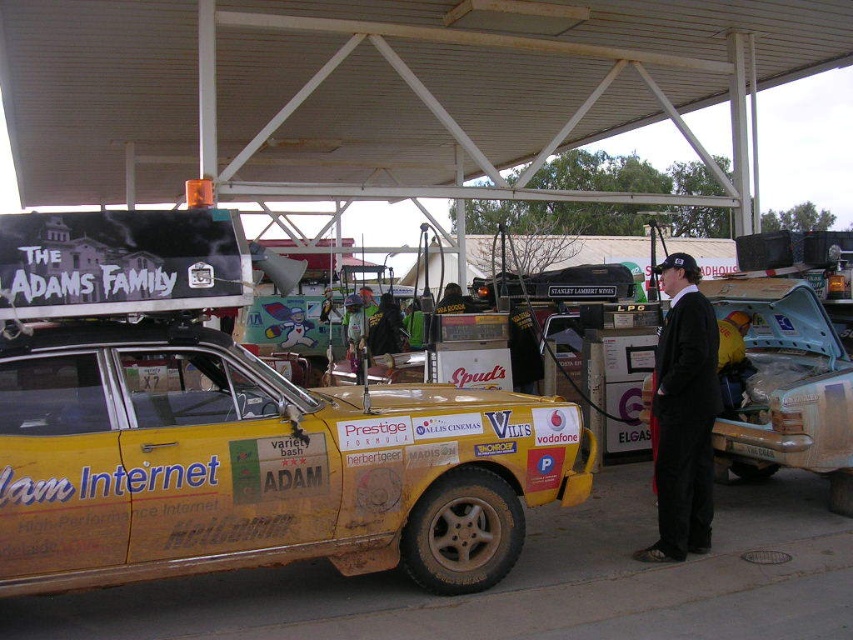
Is rusty metal car at center closer to camera compared to black suit at center?

No.

Is rusty metal car at center thinner than black suit at center?

No, rusty metal car at center is not thinner than black suit at center.

Is point (769, 285) behind point (686, 307)?

Yes, point (769, 285) is behind point (686, 307).

Image resolution: width=853 pixels, height=640 pixels. I want to click on rusty metal car at center, so click(785, 387).

Which is more to the right, yellow matte taxi at center or rusty metal car at center?

From the viewer's perspective, rusty metal car at center appears more on the right side.

Between point (152, 348) and point (817, 324), which one is positioned in front?

Point (152, 348) is more forward.

Is point (239, 513) positioned before point (780, 404)?

Yes, it is in front of point (780, 404).

Identify the location of yellow matte taxi at center. The width and height of the screenshot is (853, 640). (257, 465).

Does point (138, 529) come closer to viewer compared to point (688, 358)?

Yes, it is.

Does point (343, 547) lie behind point (689, 396)?

No, (343, 547) is in front of (689, 396).

Between point (485, 408) and point (677, 534), which one is positioned behind?

Point (677, 534)

You are a GUI agent. You are given a task and a screenshot of the screen. Output one action in this format:
    pyautogui.click(x=<x>, y=<y>)
    Task: Click on the yellow matte taxi at center
    This screenshot has height=640, width=853.
    Given the screenshot: What is the action you would take?
    pyautogui.click(x=257, y=465)